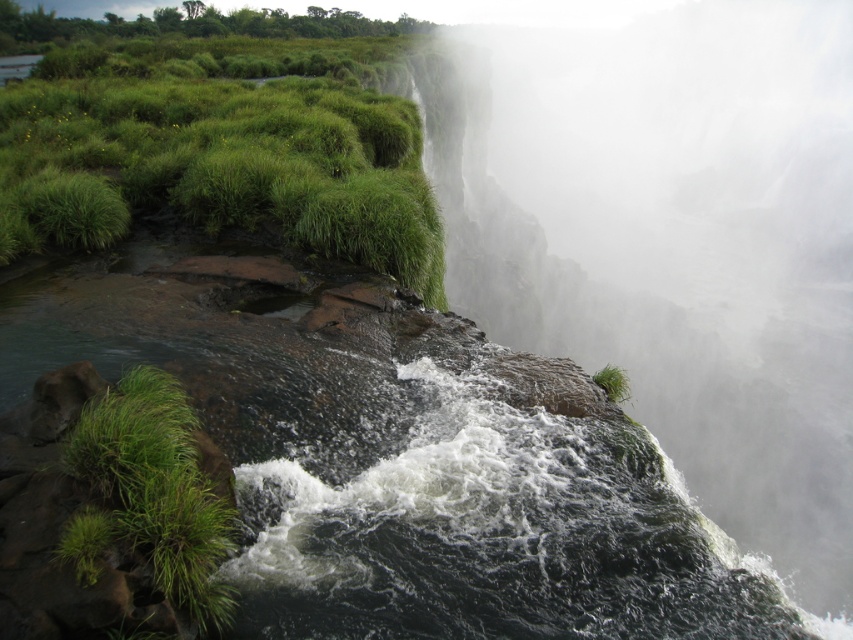
Who is more distant from viewer, (82, 147) or (138, 525)?

Positioned behind is point (82, 147).

Looking at this image, is green grassy at upper left shorter than green grassy tuft at lower left?

No.

Which is in front, point (33, 125) or point (86, 564)?

Point (86, 564)

This screenshot has width=853, height=640. I want to click on green grassy at upper left, so click(218, 150).